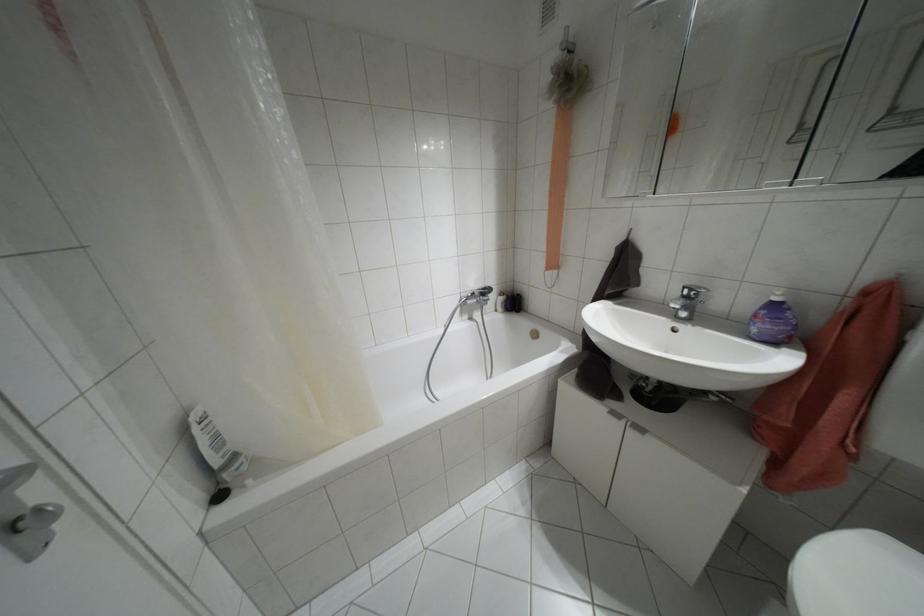
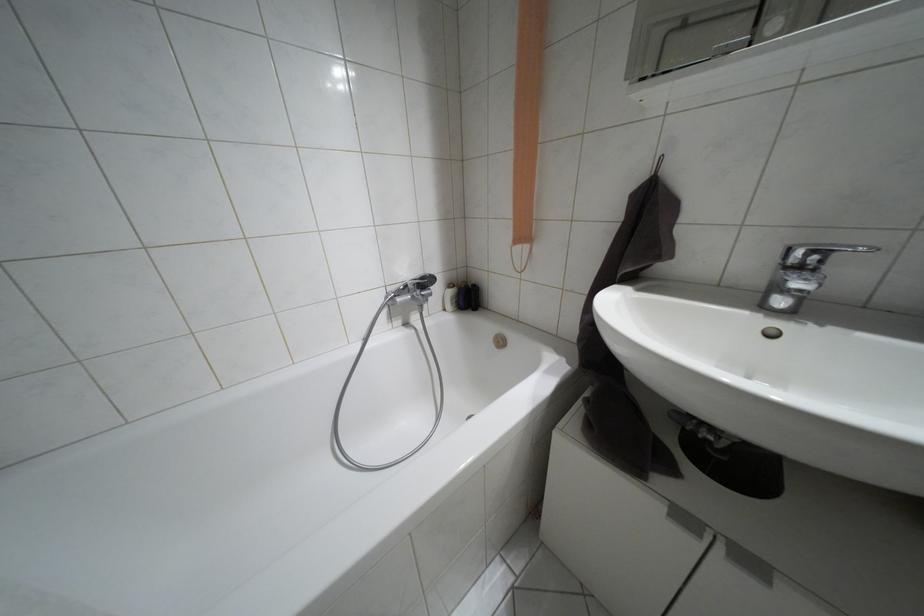
Question: Which direction would the cameraman need to move to produce the second image? Reply with the corresponding letter.

Choices:
 (A) Left
 (B) Right
 (C) Forward
 (D) Backward

Answer: (C)